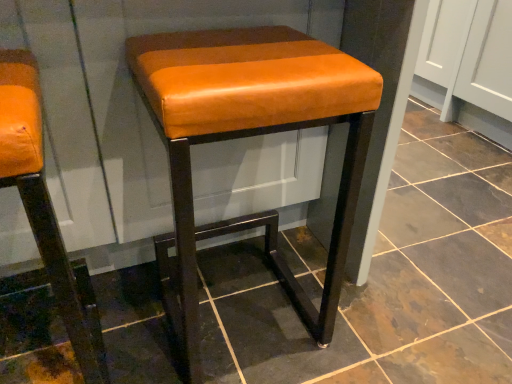
Locate an element on the screen. This screenshot has width=512, height=384. free spot behind orange leather stool at left, the first stool in the left-to-right sequence is located at coordinates (103, 303).